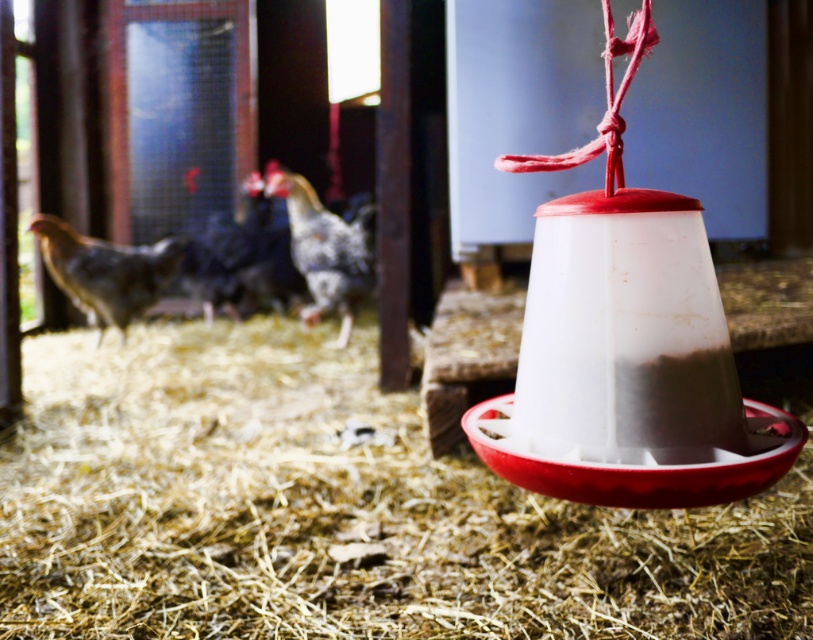
Which of these two, brown straw at center or blue speckled feathers at center, stands shorter?

Standing shorter between the two is brown straw at center.

Is brown straw at center to the right of blue speckled feathers at center from the viewer's perspective?

Indeed, brown straw at center is positioned on the right side of blue speckled feathers at center.

Where is `brown straw at center`? This screenshot has width=813, height=640. brown straw at center is located at coordinates (337, 512).

Who is positioned more to the right, brown straw at center or speckled feathered chicken at center?

From the viewer's perspective, brown straw at center appears more on the right side.

The height and width of the screenshot is (640, 813). Describe the element at coordinates (337, 512) in the screenshot. I see `brown straw at center` at that location.

Locate an element on the screen. brown straw at center is located at coordinates (337, 512).

Is blue speckled feathers at center wider than speckled feathered chicken at center?

Correct, the width of blue speckled feathers at center exceeds that of speckled feathered chicken at center.

Between point (263, 218) and point (324, 243), which one is positioned behind?

The point (263, 218) is behind.

Is point (279, 307) farther from camera compared to point (355, 243)?

Yes, point (279, 307) is farther from viewer.

Where is `blue speckled feathers at center`? This screenshot has height=640, width=813. blue speckled feathers at center is located at coordinates (241, 259).